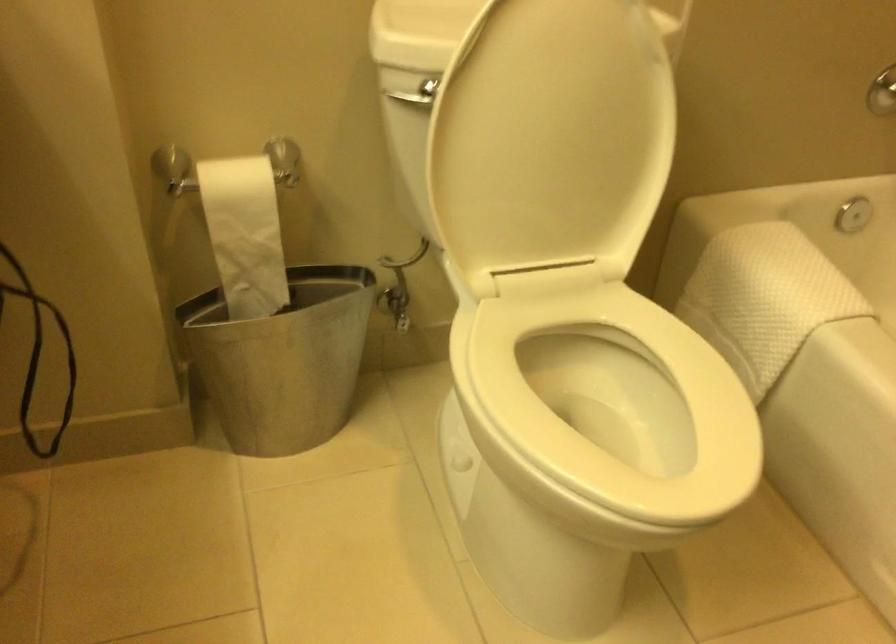
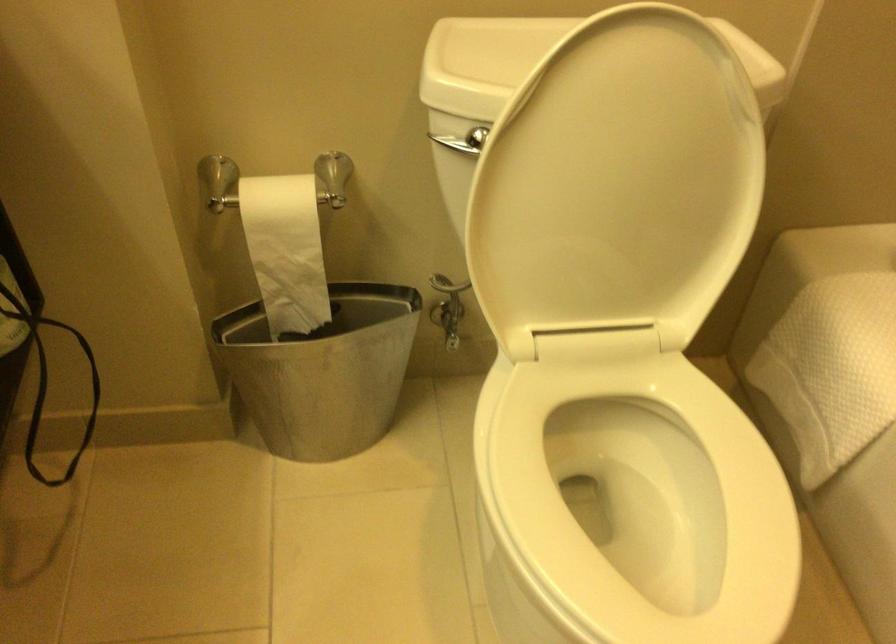
In the second image, find the point that corresponds to (x=245, y=232) in the first image.

(286, 250)